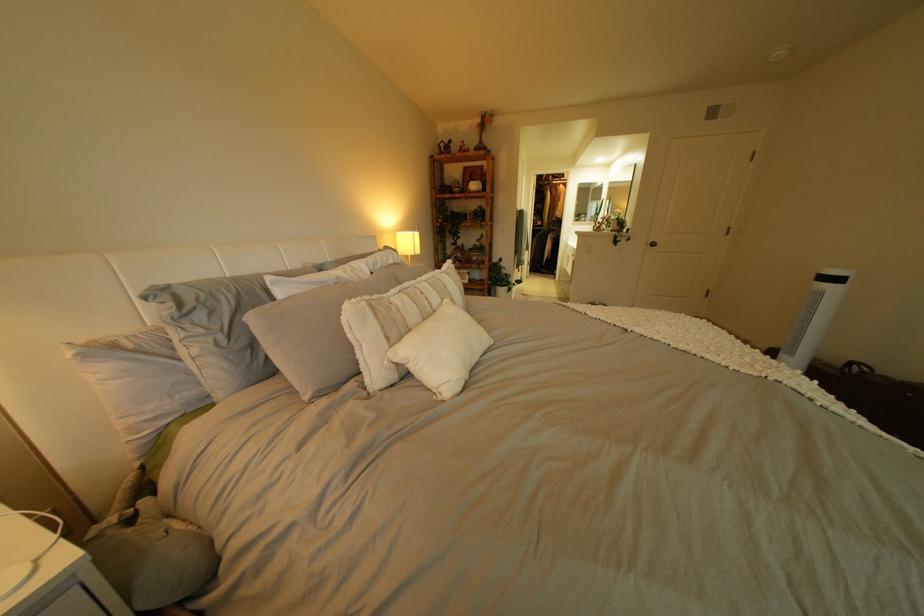
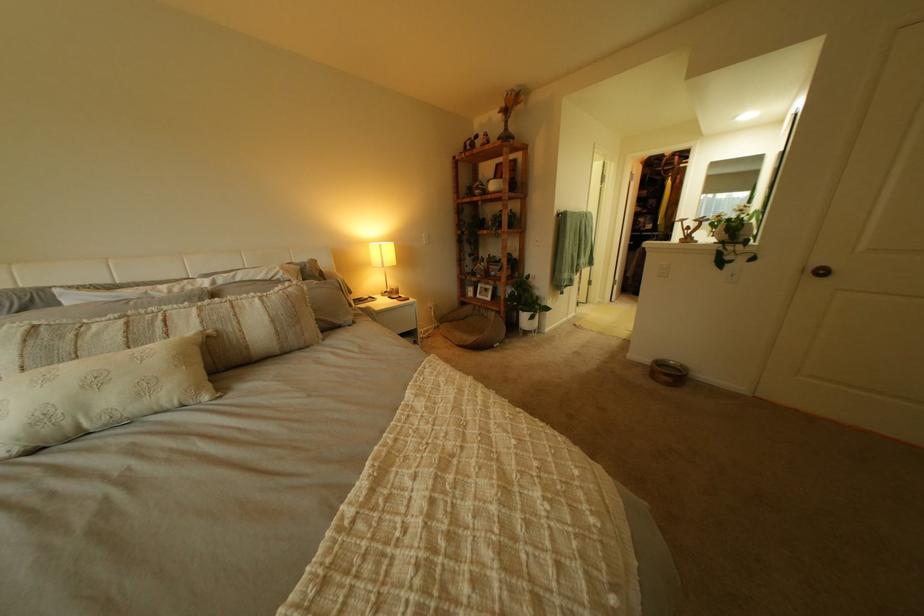
Where in the second image is the point corresponding to pixel 475 185 from the first image?

(497, 185)